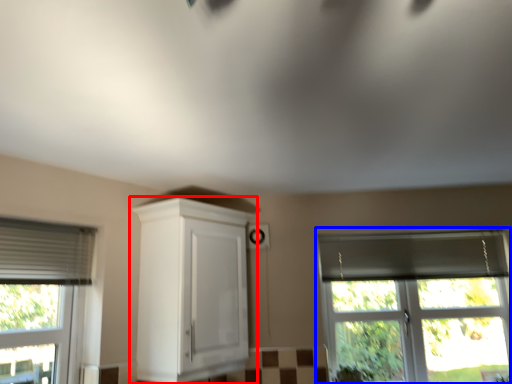
Question: Among these objects, which one is farthest to the camera, cabinetry (highlighted by a red box) or window (highlighted by a blue box)?

Choices:
 (A) cabinetry
 (B) window

Answer: (B)